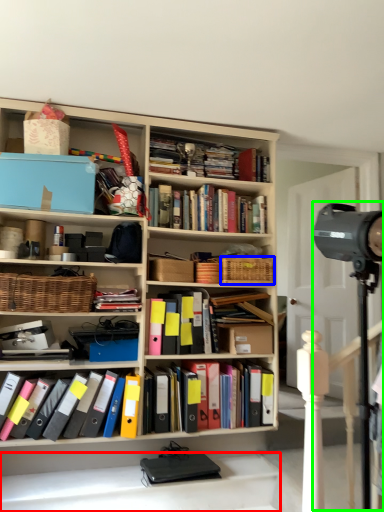
Question: Which object is the farthest from stairwell (highlighted by a red box)? Choose among these: basket (highlighted by a blue box) or television camera (highlighted by a green box).

Choices:
 (A) basket
 (B) television camera

Answer: (B)